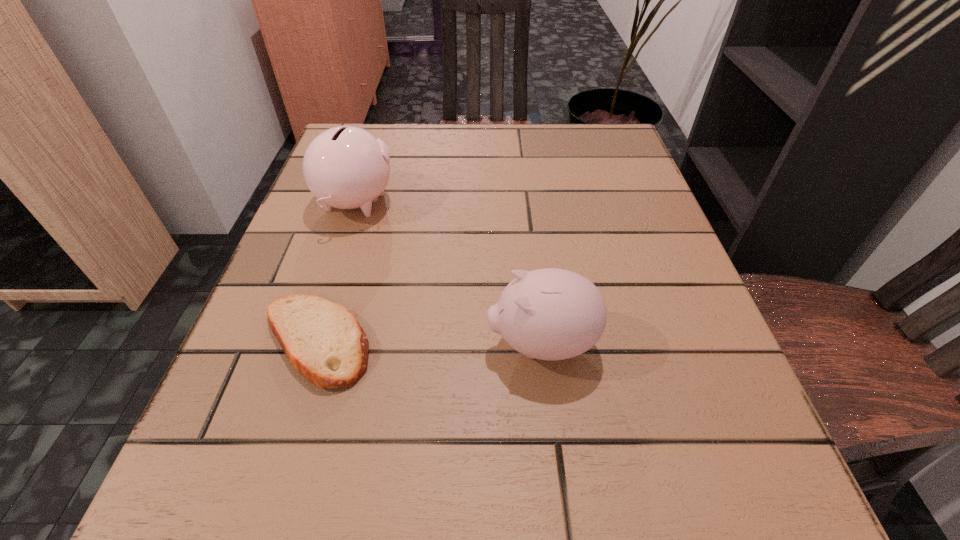
The width and height of the screenshot is (960, 540). Find the location of `the farthest object`. the farthest object is located at coordinates (347, 167).

Where is `the tallest object`? the tallest object is located at coordinates (347, 167).

The image size is (960, 540). In order to click on the shorter piggy bank in this screenshot , I will do `click(551, 314)`.

Locate an element on the screen. The width and height of the screenshot is (960, 540). the second shortest object is located at coordinates pyautogui.click(x=551, y=314).

You are a GUI agent. You are given a task and a screenshot of the screen. Output one action in this format:
    pyautogui.click(x=<x>, y=<y>)
    Task: Click on the shortest object
    
    Given the screenshot: What is the action you would take?
    pyautogui.click(x=323, y=341)

Locate an element on the screen. Image resolution: width=960 pixels, height=540 pixels. free region located 0.290m on the front of the left piggy bank is located at coordinates (301, 372).

This screenshot has height=540, width=960. I want to click on vacant space located 0.320m at the snout of the second tallest object, so click(x=268, y=343).

I want to click on vacant space located 0.090m at the snout of the second tallest object, so click(425, 343).

I want to click on vacant space located at the snout of the second tallest object, so click(x=323, y=343).

I want to click on free space located 0.220m on the back of the pita bread, so click(355, 214).